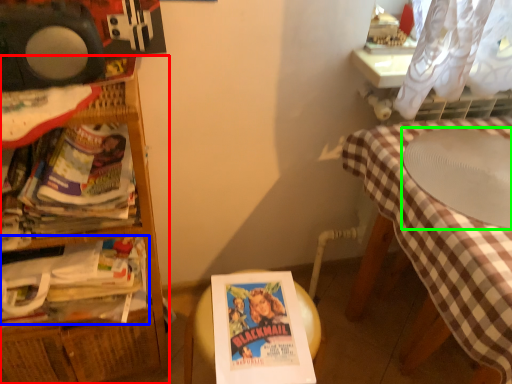
Question: Considering the real-world distances, which object is closest to furniture (highlighted by a red box)? book (highlighted by a blue box) or round table (highlighted by a green box).

Choices:
 (A) book
 (B) round table

Answer: (A)